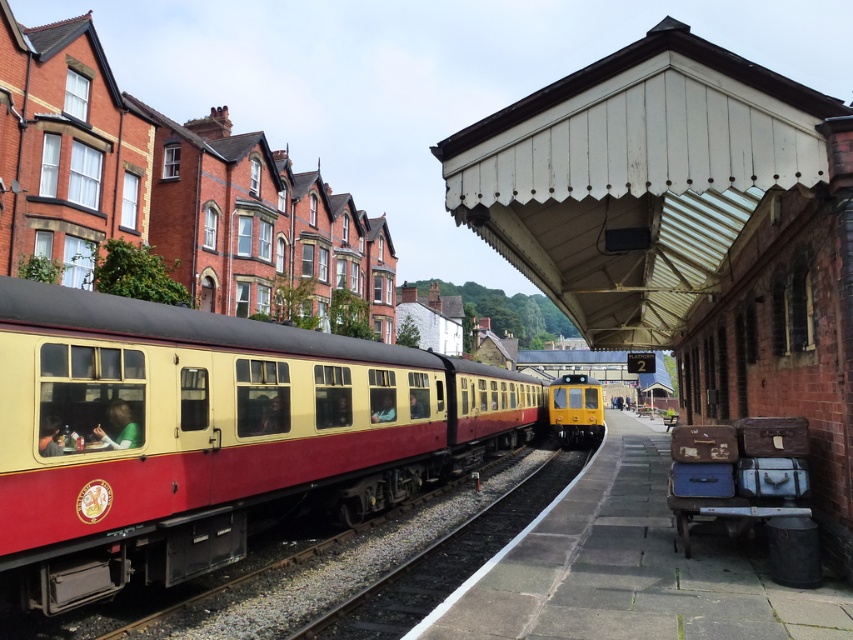
You are a passenger standing on Platform 2 at the train station. You see the matte cream train at center and the yellow matte train at center. Which train is closer to the edge of the platform marked by the white line?

The matte cream train at center and yellow matte train at center are 13.12 meters apart. However, the description does not specify their positions relative to the platform edge marked by the white line, so it is impossible to determine which is closer.

You are a passenger waiting at the train station. You see the smooth metal train track at center and the yellow matte train at center. Which object is closer to the platform edge marked by the white line?

The yellow matte train at center is closer to the platform edge marked by the white line because the smooth metal train track at center is positioned to its left side.